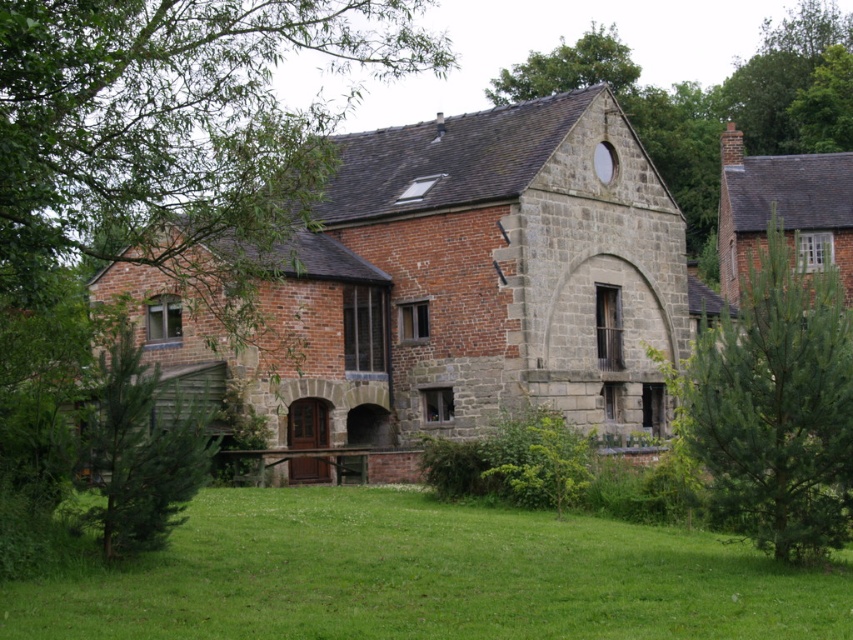
You are an architect planning to add a new structure next to the brick stone chapel at center and the green leafy tree at upper center. Based on their sizes, which one should you consider for space allocation?

The brick stone chapel at center is larger in size compared to the green leafy tree at upper center, so you should prioritize space allocation for the brick stone chapel at center.

You are standing in front of the brick stone chapel at center and the green leafy tree at upper center. Which one is positioned to the left?

The brick stone chapel at center is positioned to the left of the green leafy tree at upper center.

You are standing in front of the traditional brick building. There is a point at coordinates (137, 445). What object is located at that point?

The point at coordinates (137, 445) corresponds to the green textured tree at lower left.